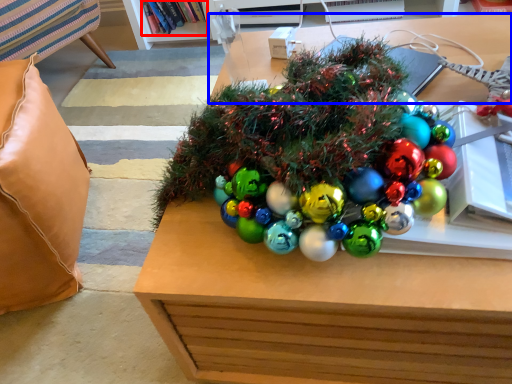
Question: Which object appears farthest to the camera in this image, book (highlighted by a red box) or table (highlighted by a blue box)?

Choices:
 (A) book
 (B) table

Answer: (A)